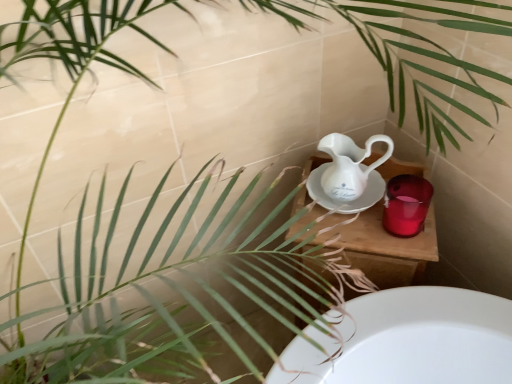
Question: Is white porcelain jug at center situated inside glossy ceramic mug at upper right or outside?

Choices:
 (A) inside
 (B) outside

Answer: (B)

Question: From a real-world perspective, is white porcelain jug at center positioned above or below glossy ceramic mug at upper right?

Choices:
 (A) below
 (B) above

Answer: (B)

Question: Considering the real-world distances, which object is farthest from the wooden table at center?

Choices:
 (A) white porcelain jug at center
 (B) glossy ceramic mug at upper right

Answer: (A)

Question: Considering the real-world distances, which object is farthest from the white porcelain jug at center?

Choices:
 (A) glossy ceramic mug at upper right
 (B) wooden table at center

Answer: (A)